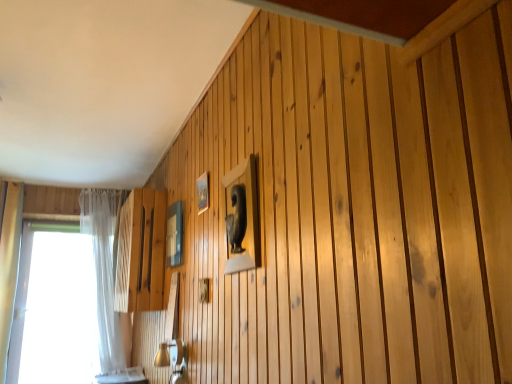
Question: From a real-world perspective, is matte glass picture frame at upper center, acting as the second picture frame starting from the right, under wooden frame at upper center, the 1th picture frame positioned from the front?

Choices:
 (A) no
 (B) yes

Answer: (B)

Question: From a real-world perspective, is matte glass picture frame at upper center, arranged as the first picture frame when viewed from the back, positioned over wooden frame at upper center, the 1th picture frame positioned from the front, based on gravity?

Choices:
 (A) no
 (B) yes

Answer: (A)

Question: Can you confirm if matte glass picture frame at upper center, acting as the second picture frame starting from the right, is taller than wooden frame at upper center, which ranks as the 2th picture frame in back-to-front order?

Choices:
 (A) yes
 (B) no

Answer: (A)

Question: Is matte glass picture frame at upper center, acting as the second picture frame starting from the right, facing away from wooden frame at upper center, marked as the 2th picture frame in a left-to-right arrangement?

Choices:
 (A) yes
 (B) no

Answer: (B)

Question: Considering the relative sizes of matte glass picture frame at upper center, which is the 2th picture frame in front-to-back order, and wooden frame at upper center, the 1th picture frame positioned from the front, in the image provided, is matte glass picture frame at upper center, which is the 2th picture frame in front-to-back order, smaller than wooden frame at upper center, the 1th picture frame positioned from the front,?

Choices:
 (A) yes
 (B) no

Answer: (B)

Question: Does matte glass picture frame at upper center, which ranks as the 1th picture frame in left-to-right order, turn towards wooden frame at upper center, marked as the 2th picture frame in a left-to-right arrangement?

Choices:
 (A) no
 (B) yes

Answer: (A)

Question: From a real-world perspective, is white sheer curtain at left located higher than wooden frame at upper center, the 1th picture frame positioned from the front?

Choices:
 (A) yes
 (B) no

Answer: (B)

Question: Considering the relative sizes of white sheer curtain at left and wooden frame at upper center, the 1th picture frame positioned from the front, in the image provided, is white sheer curtain at left thinner than wooden frame at upper center, the 1th picture frame positioned from the front,?

Choices:
 (A) yes
 (B) no

Answer: (B)

Question: Considering the relative sizes of white sheer curtain at left and wooden frame at upper center, which ranks as the 2th picture frame in back-to-front order, in the image provided, is white sheer curtain at left shorter than wooden frame at upper center, which ranks as the 2th picture frame in back-to-front order,?

Choices:
 (A) yes
 (B) no

Answer: (B)

Question: Does white sheer curtain at left turn towards wooden frame at upper center, the 1th picture frame positioned from the front?

Choices:
 (A) no
 (B) yes

Answer: (B)

Question: From the image's perspective, is white sheer curtain at left located beneath wooden frame at upper center, which ranks as the 2th picture frame in back-to-front order?

Choices:
 (A) no
 (B) yes

Answer: (B)

Question: From the image's perspective, is white sheer curtain at left over wooden frame at upper center, marked as the 2th picture frame in a left-to-right arrangement?

Choices:
 (A) no
 (B) yes

Answer: (A)

Question: Is white sheer curtain at left shorter than matte glass picture frame at upper center, which ranks as the 1th picture frame in left-to-right order?

Choices:
 (A) no
 (B) yes

Answer: (A)